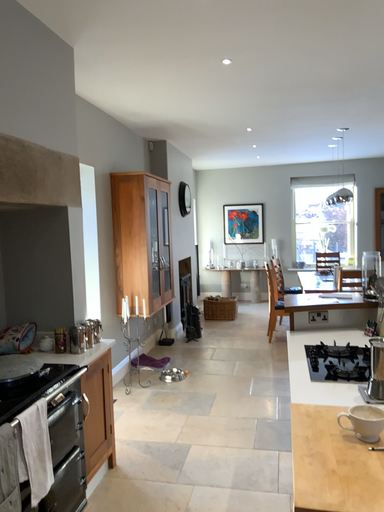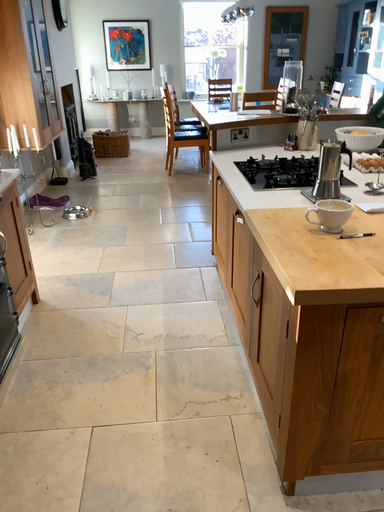
Question: Which way did the camera rotate in the video?

Choices:
 (A) rotated downward
 (B) rotated upward

Answer: (A)